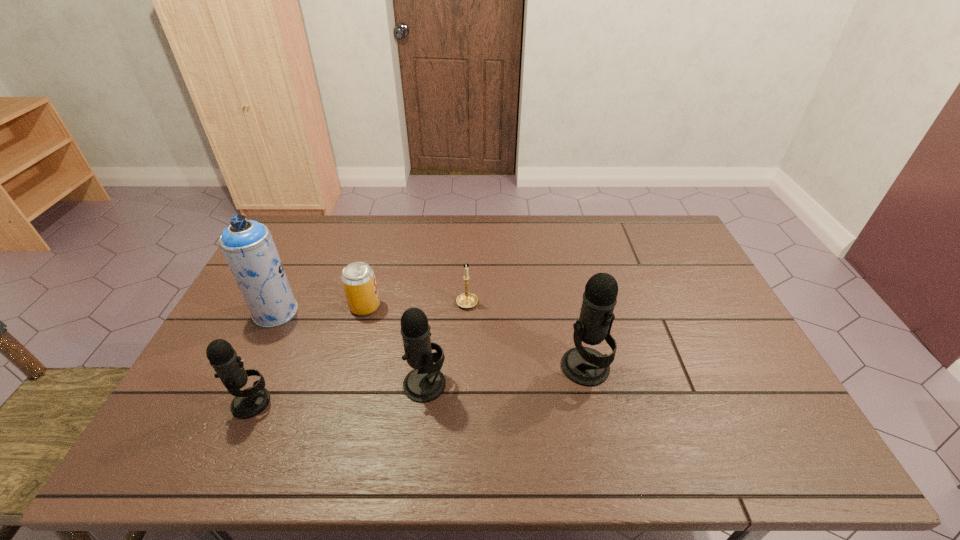
Locate an element on the screen. This screenshot has width=960, height=540. vacant spot to place a microphone on the right is located at coordinates (735, 352).